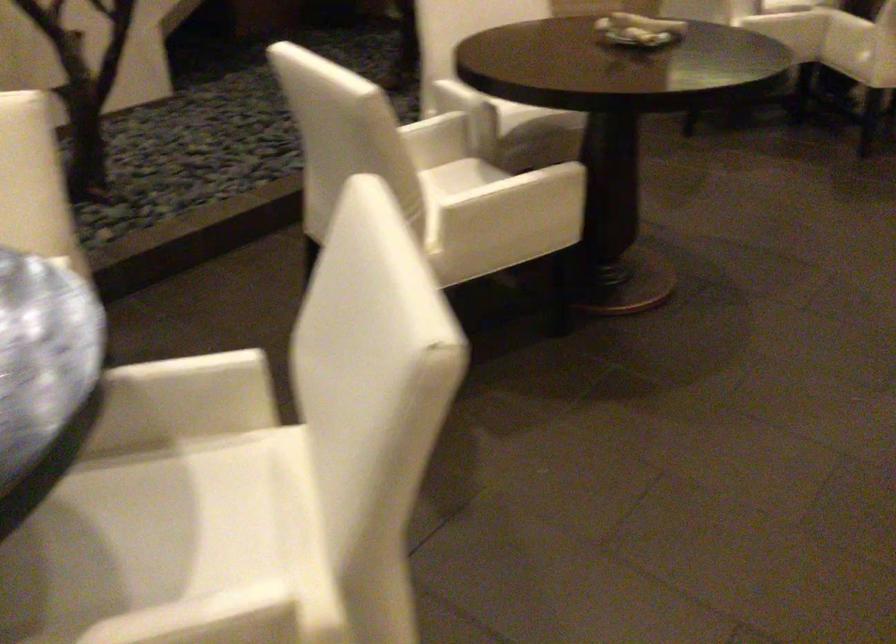
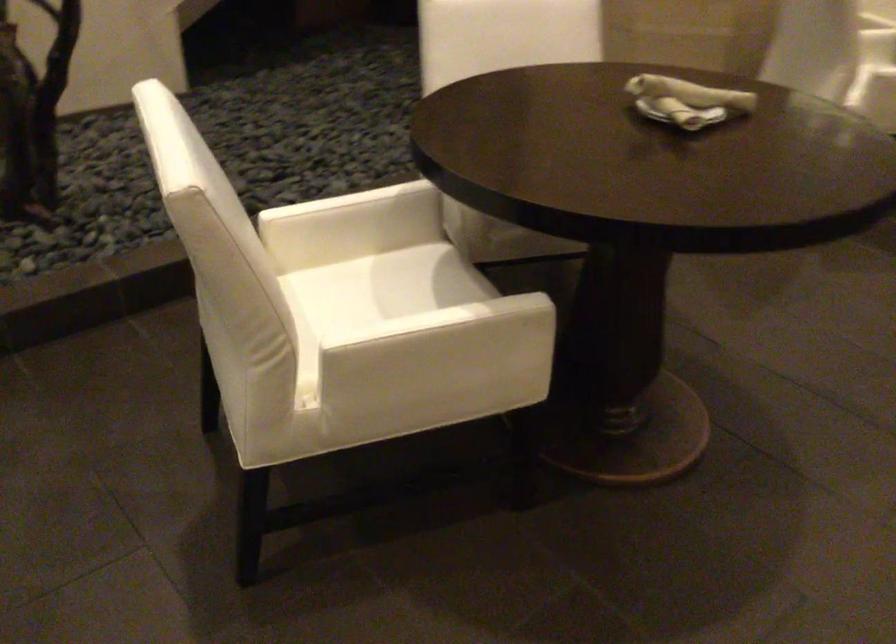
Question: The camera is either moving clockwise (left) or counter-clockwise (right) around the object. The first image is from the beginning of the video and the second image is from the end. Is the camera moving left or right when shooting the video?

Choices:
 (A) Left
 (B) Right

Answer: (B)